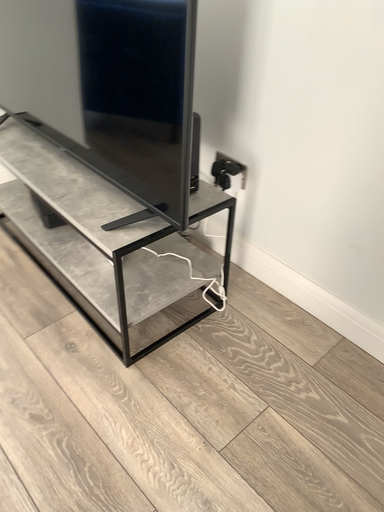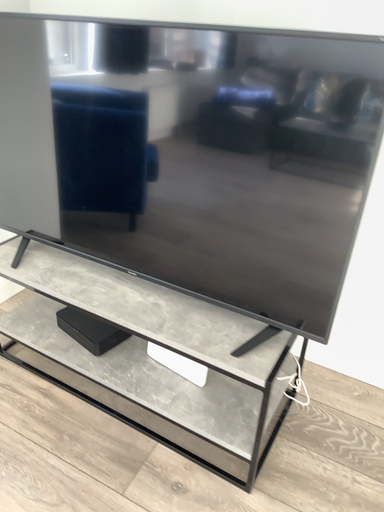
Question: How did the camera likely rotate when shooting the video?

Choices:
 (A) rotated upward
 (B) rotated downward

Answer: (A)